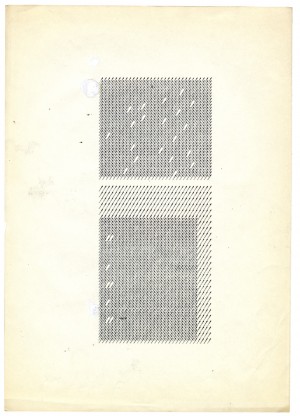
At what (x,y) coordinates should I click in order to perform the action: click on sheet. Please return your answer as a coordinate pair (x, y). Looking at the image, I should click on (38, 269).